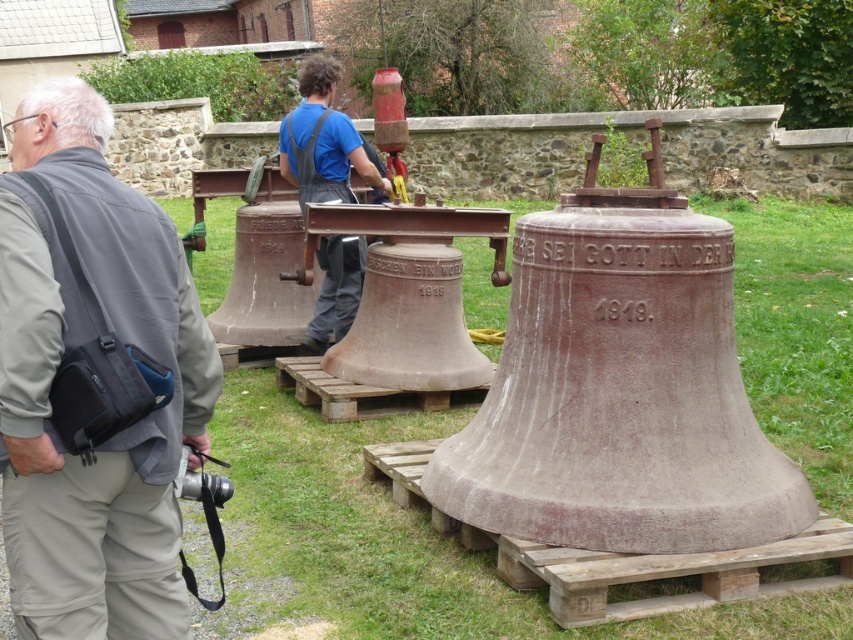
You are a worker in the scene and need to move the gray fabric bag at lower left to the other side of the blue denim overalls at center. Which direction should you move it?

The gray fabric bag at lower left is currently on the left side of the blue denim overalls at center. To move it to the other side, you should move it to the right side of the blue denim overalls at center.

You are a worker in the scene and need to carry tools. You have a gray fabric bag at lower left and blue denim overalls at center. Which item has a smaller width?

The gray fabric bag at lower left is thinner than the blue denim overalls at center, so the gray fabric bag at lower left has a smaller width.